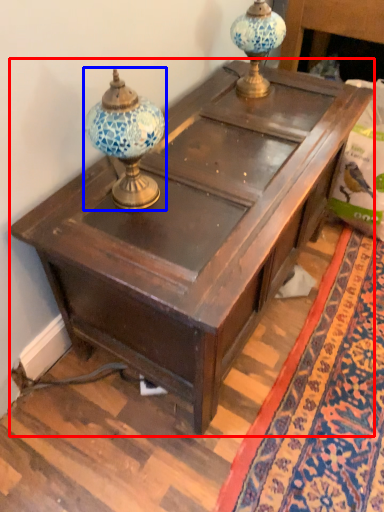
Question: Which of the following is the closest to the observer, table (highlighted by a red box) or candle holder (highlighted by a blue box)?

Choices:
 (A) table
 (B) candle holder

Answer: (B)